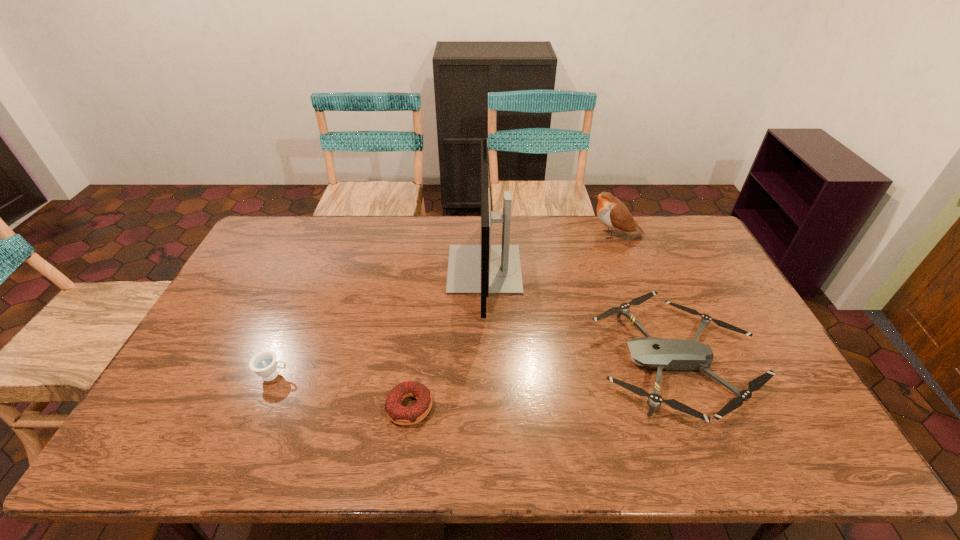
I want to click on computer monitor, so click(x=484, y=269).

Image resolution: width=960 pixels, height=540 pixels. I want to click on the third object from right to left, so click(x=484, y=269).

You are a GUI agent. You are given a task and a screenshot of the screen. Output one action in this format:
    pyautogui.click(x=<x>, y=<y>)
    Task: Click on the second tallest object
    Image resolution: width=960 pixels, height=540 pixels.
    Given the screenshot: What is the action you would take?
    pyautogui.click(x=614, y=214)

The height and width of the screenshot is (540, 960). What are the coordinates of `drone` in the screenshot? It's located at (670, 354).

Locate an element on the screen. This screenshot has width=960, height=540. teacup is located at coordinates (264, 364).

Find the location of `the shortest object`. the shortest object is located at coordinates (396, 412).

This screenshot has height=540, width=960. In order to click on the fourth object from right to left in this screenshot , I will do `click(396, 412)`.

Identify the location of free location located on the screen of the third object from left to right. This screenshot has height=540, width=960. (362, 269).

You are a GUI agent. You are given a task and a screenshot of the screen. Output one action in this format:
    pyautogui.click(x=<x>, y=<y>)
    Task: Click on the free location located on the screen of the third object from left to right
    This screenshot has width=960, height=540.
    Given the screenshot: What is the action you would take?
    pyautogui.click(x=397, y=269)

Image resolution: width=960 pixels, height=540 pixels. In order to click on vacant space located 0.340m on the screen of the third object from left to right in this screenshot , I will do `click(348, 269)`.